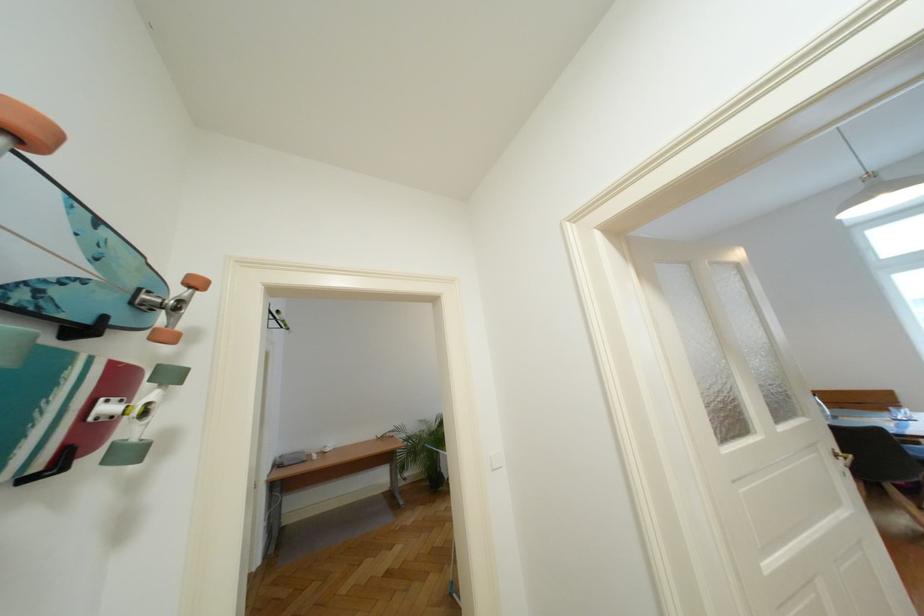
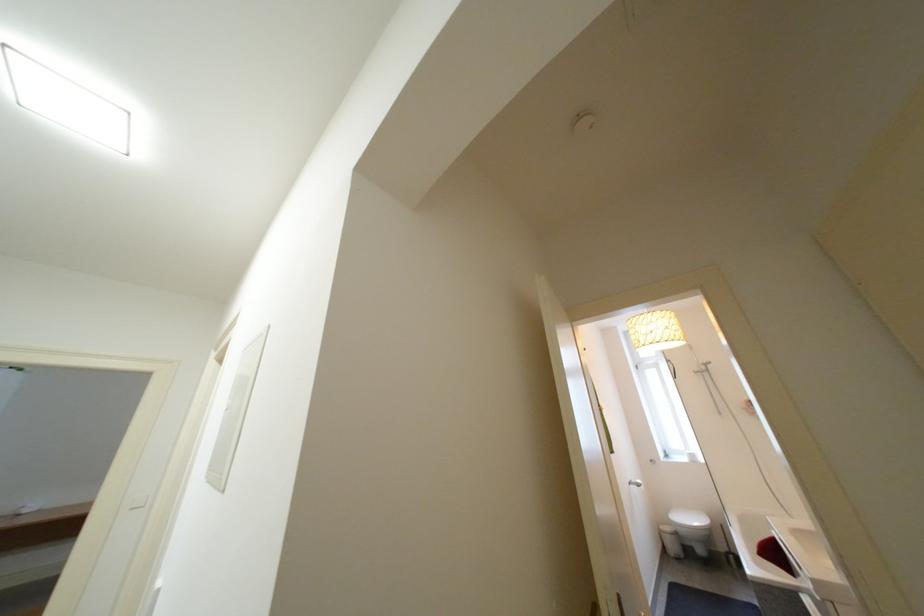
Which direction would the cameraman need to move to produce the second image?

The cameraman walked toward right, backward.